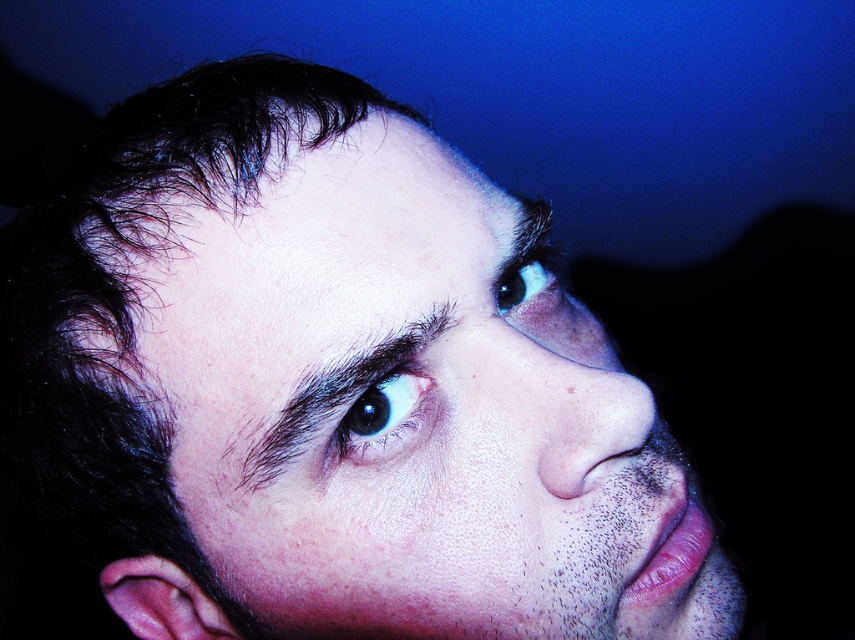
Based on the scene description, where is the smooth skin nose at center located in terms of coordinates?

The smooth skin nose at center is located at coordinates point [590,424].

You are a photographer trying to capture a close portrait. You have a camera with a 50mm lens and are currently positioned 12 inches away from the dark brown hair at upper center. To ensure the subject fills the frame properly, should you move closer or farther away?

The dark brown hair at upper center and viewer are 10.98 inches apart. Since you are currently 12 inches away, which is slightly farther than the ideal distance, you should move closer by approximately 1.02 inches to achieve the optimal framing.

You are a photographer adjusting the lighting for a portrait. You notice the black glossy eye at center and the blue glossy eye at upper center. How far apart are these two eyes in inches?

The black glossy eye at center is 2.76 inches away from the blue glossy eye at upper center.